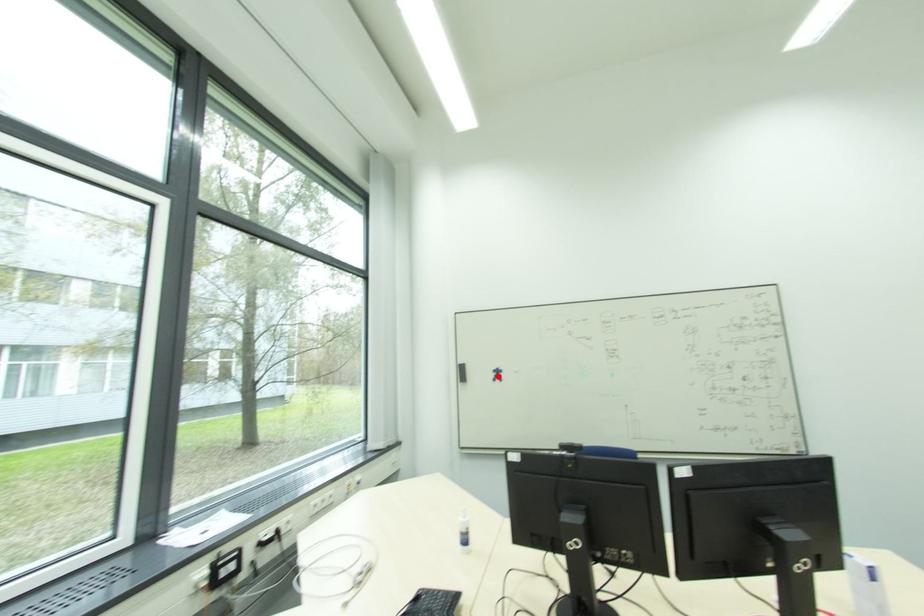
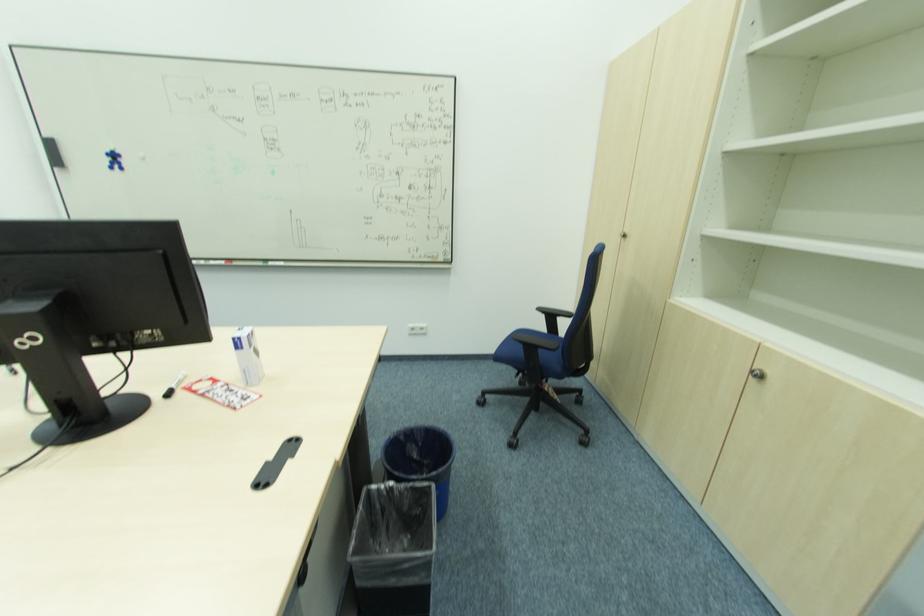
Where in the second image is the point corresponding to the highlighted location from the first image?

(116, 161)